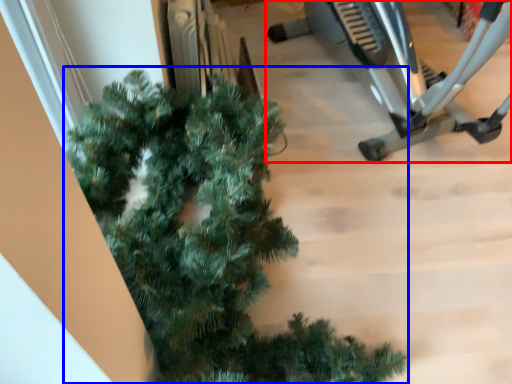
Question: Which object appears farthest to the camera in this image, stationary bicycle (highlighted by a red box) or christmas tree (highlighted by a blue box)?

Choices:
 (A) stationary bicycle
 (B) christmas tree

Answer: (A)